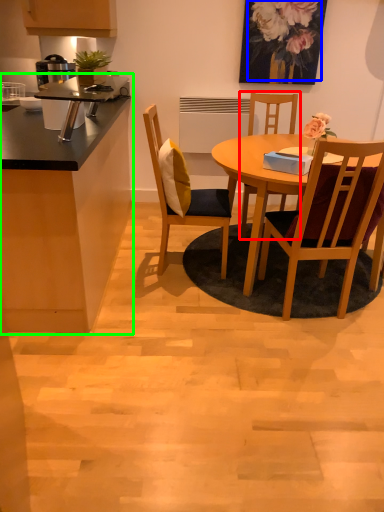
Question: Which object is the closest to the chair (highlighted by a red box)? Choose among these: floral arrangement (highlighted by a blue box) or cabinetry (highlighted by a green box).

Choices:
 (A) floral arrangement
 (B) cabinetry

Answer: (A)